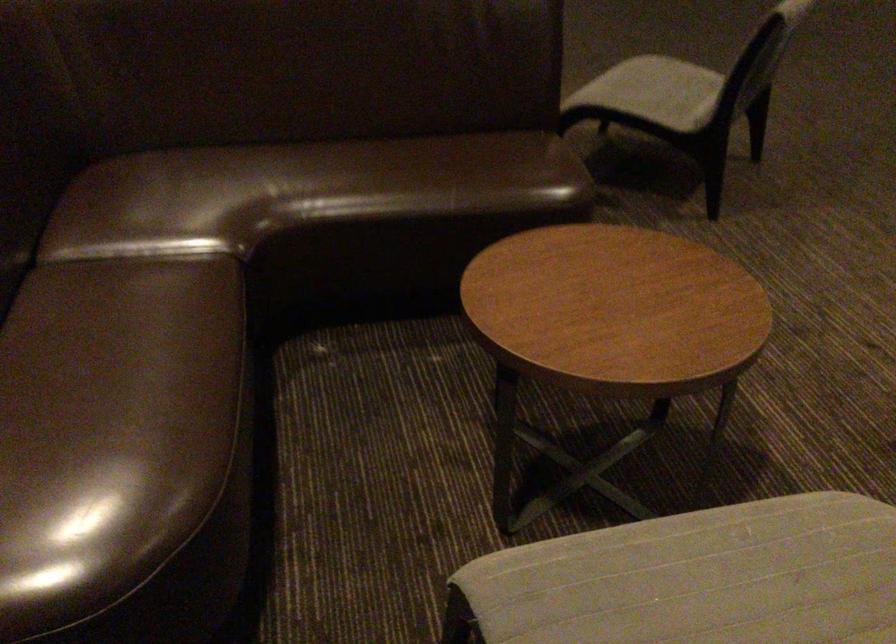
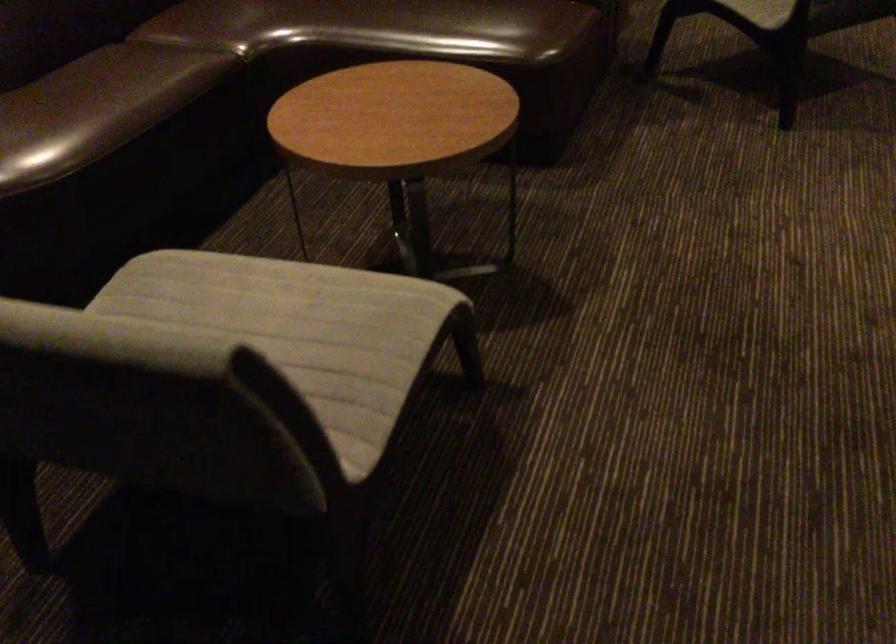
In the second image, find the point that corresponds to (728,573) in the first image.

(280, 299)